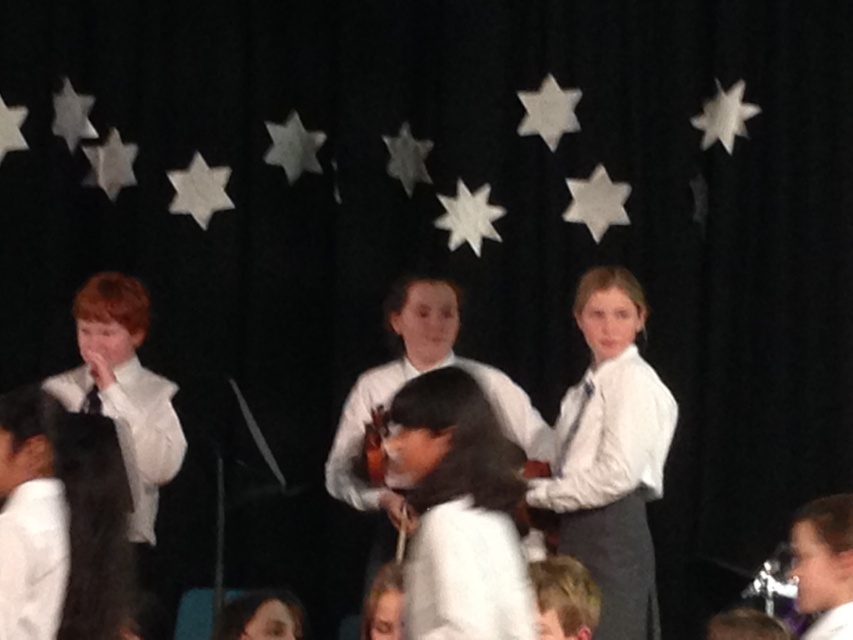
You are a photographer in the audience. You want to capture a photo where both the white satin shirt at center and the white fabric shirt at center are visible. Since the stage is dimly lit, you need to ensure that the taller shirt is not blocking the shorter one. Which shirt should you position closer to the front to avoid blocking?

The white satin shirt at center is taller than the white fabric shirt at center. To prevent blocking, position the white fabric shirt at center closer to the front since it is shorter, allowing the taller white satin shirt at center to be slightly behind but still visible.

You are a photographer positioned at the front of the stage. You want to capture a closeup shot of the white fabric shirt at center. Based on its position, which part of the stage should you aim your camera towards?

The white fabric shirt at center is located at point 0.800 on the x axis and 0.538 on the y axis, so you should aim your camera towards the central area slightly to the right since the x coordinate is closer to 0.8, which is more towards the right side of the stage.

You are a photographer standing at the back of the stage. You need to take a photo of both the white satin shirt at center and the white fabric shirt at center. Can you fit both shirts into your camera frame if your camera has a maximum horizontal field of view of 1.2 meters?

The white satin shirt at center and white fabric shirt at center are 1.17 meters apart from each other. Since 1.17 meters is less than the camera frame width of 1.2 meters, both shirts can be captured in the same photo.